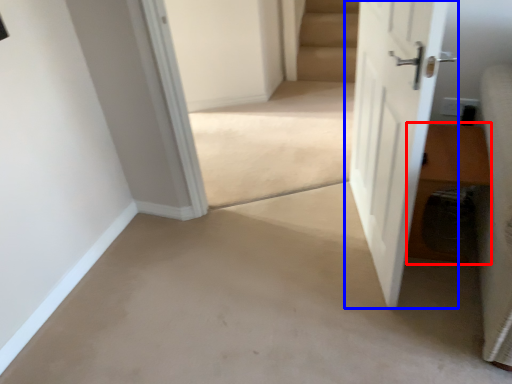
Question: Among these objects, which one is farthest to the camera, hardwood (highlighted by a red box) or door (highlighted by a blue box)?

Choices:
 (A) hardwood
 (B) door

Answer: (A)